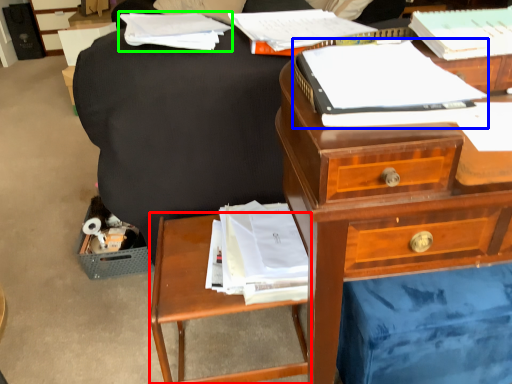
Question: Which object is the closest to the nightstand (highlighted by a red box)? Choose among these: paperback book (highlighted by a blue box) or book (highlighted by a green box).

Choices:
 (A) paperback book
 (B) book

Answer: (A)